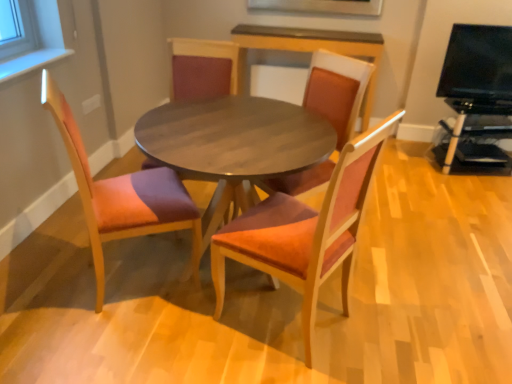
Question: Can you confirm if matte wood chair at center, the 2th chair in the right-to-left sequence, is positioned to the right of black plastic entertainment center at right, acting as the 1th entertainment center starting from the bottom?

Choices:
 (A) no
 (B) yes

Answer: (A)

Question: Considering the relative sizes of matte wood chair at center, which appears as the 3th chair when viewed from the left, and black plastic entertainment center at right, which appears as the second entertainment center when viewed from the top, in the image provided, is matte wood chair at center, which appears as the 3th chair when viewed from the left, smaller than black plastic entertainment center at right, which appears as the second entertainment center when viewed from the top,?

Choices:
 (A) no
 (B) yes

Answer: (A)

Question: From a real-world perspective, is matte wood chair at center, the 2th chair in the right-to-left sequence, on top of black plastic entertainment center at right, acting as the 1th entertainment center starting from the bottom?

Choices:
 (A) yes
 (B) no

Answer: (A)

Question: Considering the relative positions of matte wood chair at center, which appears as the 3th chair when viewed from the left, and black plastic entertainment center at right, which appears as the second entertainment center when viewed from the top, in the image provided, is matte wood chair at center, which appears as the 3th chair when viewed from the left, to the left of black plastic entertainment center at right, which appears as the second entertainment center when viewed from the top, from the viewer's perspective?

Choices:
 (A) no
 (B) yes

Answer: (B)

Question: Is matte wood chair at center, the 2th chair in the right-to-left sequence, outside black plastic entertainment center at right, which appears as the second entertainment center when viewed from the top?

Choices:
 (A) no
 (B) yes

Answer: (B)

Question: Is matte wood chair at center, which appears as the 3th chair when viewed from the right, inside the boundaries of suede-like orange chair at center, acting as the 4th chair starting from the left, or outside?

Choices:
 (A) outside
 (B) inside

Answer: (A)

Question: From a real-world perspective, is matte wood chair at center, which is the 2th chair from left to right, physically located above or below suede-like orange chair at center, acting as the 4th chair starting from the left?

Choices:
 (A) above
 (B) below

Answer: (B)

Question: From the image's perspective, relative to suede-like orange chair at center, acting as the 4th chair starting from the left, is matte wood chair at center, which appears as the 3th chair when viewed from the right, above or below?

Choices:
 (A) above
 (B) below

Answer: (A)

Question: Is matte wood chair at center, which is the 2th chair from left to right, in front of or behind suede-like orange chair at center, acting as the 4th chair starting from the left, in the image?

Choices:
 (A) front
 (B) behind

Answer: (B)

Question: Considering the positions of matte wood chair at center, which is the 2th chair from left to right, and matte wood chair at center, the 2th chair in the right-to-left sequence, in the image, is matte wood chair at center, which is the 2th chair from left to right, taller or shorter than matte wood chair at center, the 2th chair in the right-to-left sequence,?

Choices:
 (A) tall
 (B) short

Answer: (A)

Question: Considering the positions of matte wood chair at center, which is the 2th chair from left to right, and matte wood chair at center, the 2th chair in the right-to-left sequence, in the image, is matte wood chair at center, which is the 2th chair from left to right, bigger or smaller than matte wood chair at center, the 2th chair in the right-to-left sequence,?

Choices:
 (A) big
 (B) small

Answer: (A)

Question: From the image's perspective, is matte wood chair at center, which is the 2th chair from left to right, located above or below matte wood chair at center, the 2th chair in the right-to-left sequence?

Choices:
 (A) below
 (B) above

Answer: (B)

Question: Relative to matte wood chair at center, the 2th chair in the right-to-left sequence, is matte wood chair at center, which appears as the 3th chair when viewed from the right, in front or behind?

Choices:
 (A) front
 (B) behind

Answer: (B)

Question: Do you think suede-like orange chair at center, the first chair viewed from the right, is within matte wood chair at center, which appears as the 3th chair when viewed from the left, or outside of it?

Choices:
 (A) inside
 (B) outside

Answer: (B)

Question: Would you say suede-like orange chair at center, acting as the 4th chair starting from the left, is to the left or to the right of matte wood chair at center, which appears as the 3th chair when viewed from the left, in the picture?

Choices:
 (A) right
 (B) left

Answer: (A)